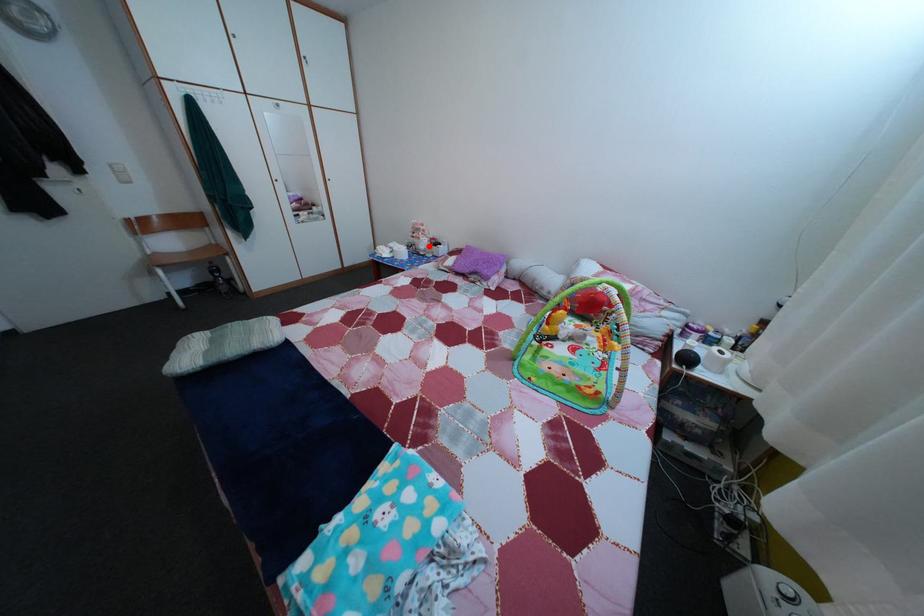
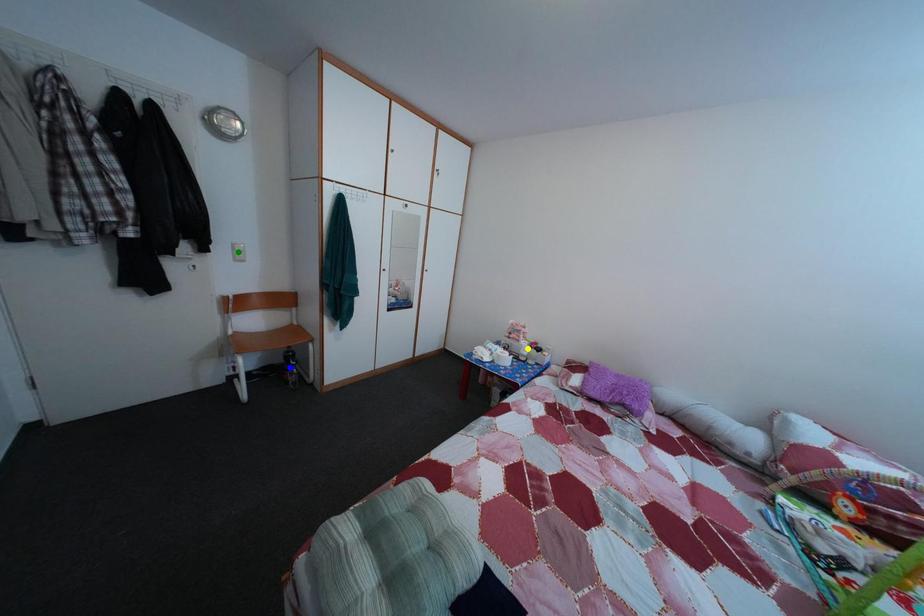
Question: I am providing you with two images of the same scene from different viewpoints. A red point is marked on the first image. You are given multiple points on the second image. Which point in image 2 is actually the same real-world point as the red point in image 1?

Choices:
 (A) yellow point
 (B) blue point
 (C) green point

Answer: (A)